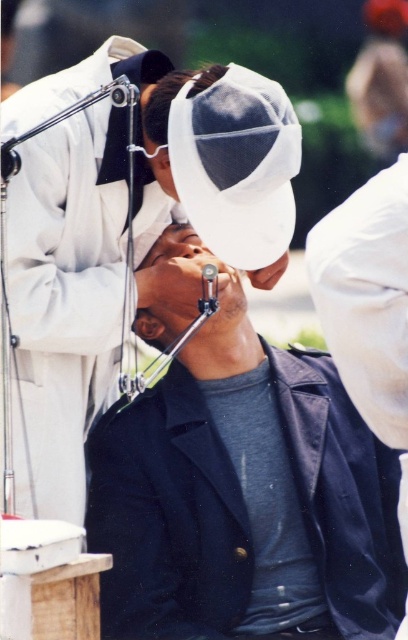
You are a photographer trying to capture a candid shot of the matte black jacket at center and the white mesh cap at upper center. Since you want to ensure both subjects are in focus, you need to know which object is wider. Which one has a greater width?

The matte black jacket at center has a greater width than the white mesh cap at upper center.

You are a photographer standing at the event venue. You need to capture a closeup shot of the dark blue fabric jacket at center. Considering your current position, is the jacket within a 5 meter range for a clear closeup?

The dark blue fabric jacket at center is 5.93 meters away from viewer, which is beyond the 5 meter range required for a clear closeup. You need to move closer or use a zoom lens.